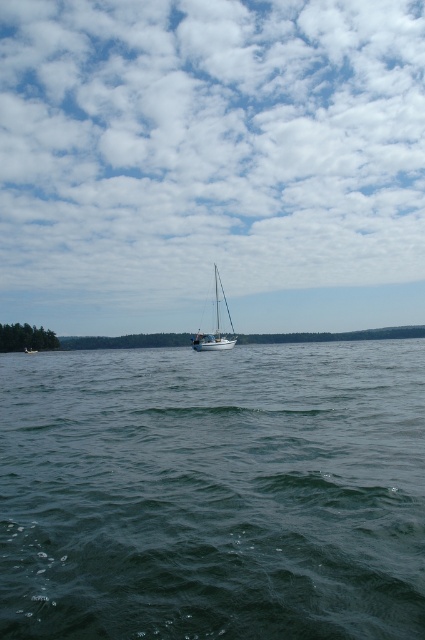
Is white fluffy cloud at upper center thinner than white sailboat at center?

No, white fluffy cloud at upper center is not thinner than white sailboat at center.

Between point (203, 113) and point (23, 349), which one is positioned behind?

Point (203, 113)

You are a GUI agent. You are given a task and a screenshot of the screen. Output one action in this format:
    pyautogui.click(x=<x>, y=<y>)
    Task: Click on the white fluffy cloud at upper center
    The width and height of the screenshot is (425, 640).
    Given the screenshot: What is the action you would take?
    pyautogui.click(x=209, y=161)

Who is lower down, white glossy sailboat at center or white sailboat at center?

Positioned lower is white sailboat at center.

From the picture: Which is above, white glossy sailboat at center or white sailboat at center?

Positioned higher is white glossy sailboat at center.

The height and width of the screenshot is (640, 425). What do you see at coordinates (215, 326) in the screenshot? I see `white glossy sailboat at center` at bounding box center [215, 326].

The width and height of the screenshot is (425, 640). Find the location of `white glossy sailboat at center`. white glossy sailboat at center is located at coordinates (215, 326).

In the scene shown: Is white fluffy cloud at upper center smaller than dark blue water at center?

No, white fluffy cloud at upper center is not smaller than dark blue water at center.

Who is taller, white fluffy cloud at upper center or dark blue water at center?

white fluffy cloud at upper center

You are a GUI agent. You are given a task and a screenshot of the screen. Output one action in this format:
    pyautogui.click(x=<x>, y=<y>)
    Task: Click on the white fluffy cloud at upper center
    
    Given the screenshot: What is the action you would take?
    pyautogui.click(x=209, y=161)